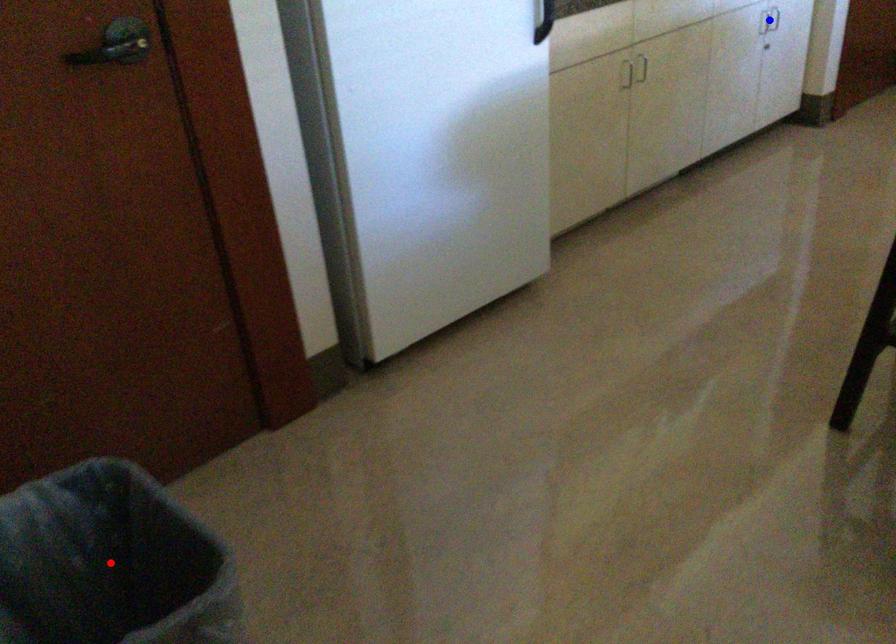
Question: Two points are marked on the image. Which point is closer to the camera?

Choices:
 (A) Blue point is closer.
 (B) Red point is closer.

Answer: (B)